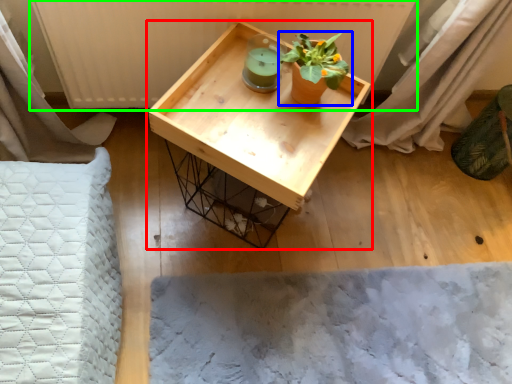
Question: Which object is the farthest from table (highlighted by a red box)? Choose among these: houseplant (highlighted by a blue box) or radiator (highlighted by a green box).

Choices:
 (A) houseplant
 (B) radiator

Answer: (B)